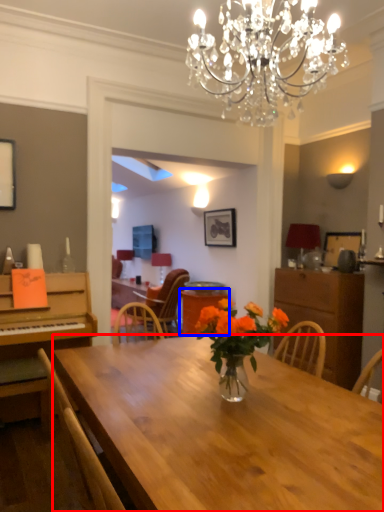
Question: Which object appears closest to the camera in this image, desk (highlighted by a red box) or table (highlighted by a blue box)?

Choices:
 (A) desk
 (B) table

Answer: (A)